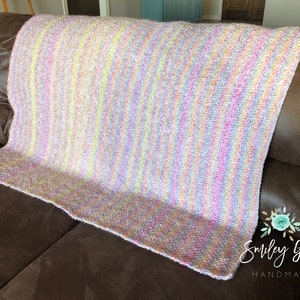
This screenshot has width=300, height=300. I want to click on soft woven throw, so click(x=212, y=266).